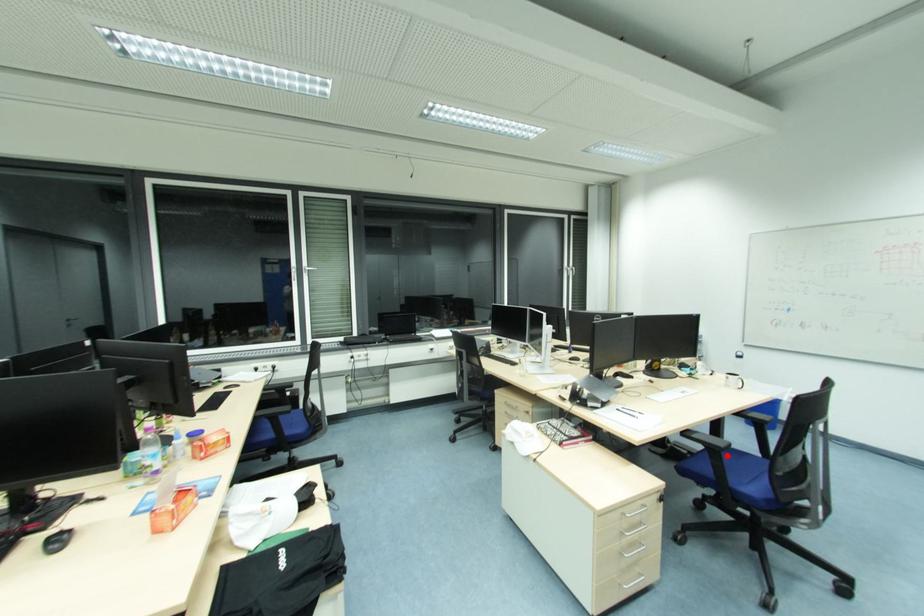
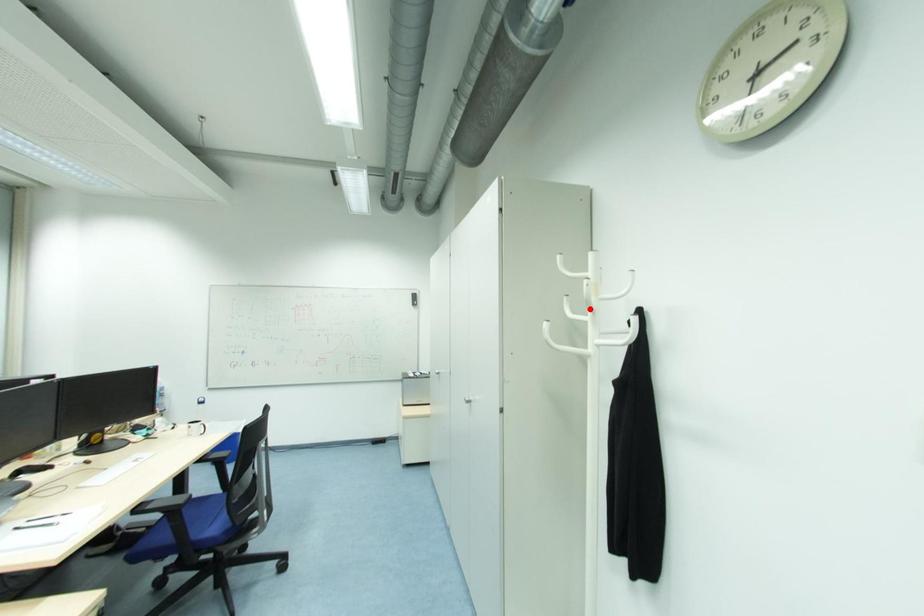
I am providing you with two images of the same scene from different viewpoints. A red point is marked on the first image and another point is marked on the second image. Is the marked point in image1 the same physical position as the marked point in image2?

No